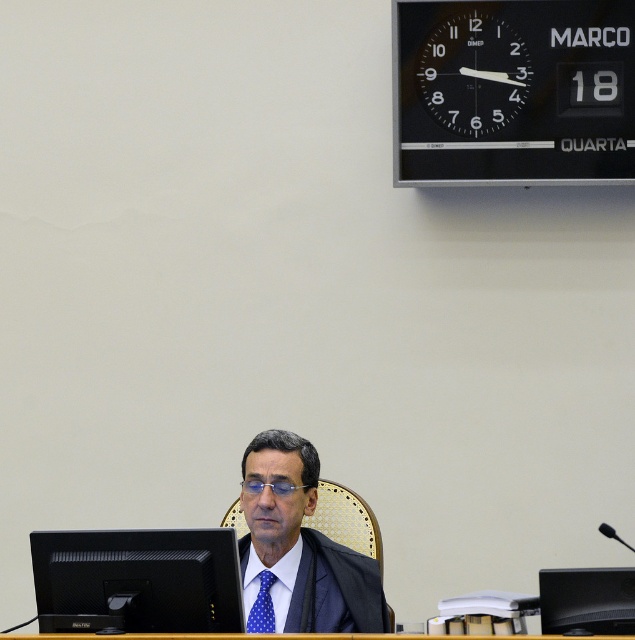
Between black plastic clock at upper center and dark gray suit at center, which one has more height?

black plastic clock at upper center is taller.

Which is more to the right, black plastic clock at upper center or dark gray suit at center?

Positioned to the right is black plastic clock at upper center.

Is point (483, 26) positioned in front of point (312, 628)?

No, (483, 26) is behind (312, 628).

I want to click on black plastic clock at upper center, so click(472, 74).

Is dark blue textured suit at center further to camera compared to dark gray suit at center?

That is False.

Locate an element on the screen. Image resolution: width=635 pixels, height=640 pixels. dark blue textured suit at center is located at coordinates (298, 548).

Consider the image. How distant is dark blue textured suit at center from black plastic table at lower center?

10.17 inches

Does dark blue textured suit at center have a lesser height compared to black plastic table at lower center?

Incorrect, dark blue textured suit at center's height does not fall short of black plastic table at lower center's.

The height and width of the screenshot is (640, 635). What are the coordinates of `dark blue textured suit at center` in the screenshot? It's located at (298, 548).